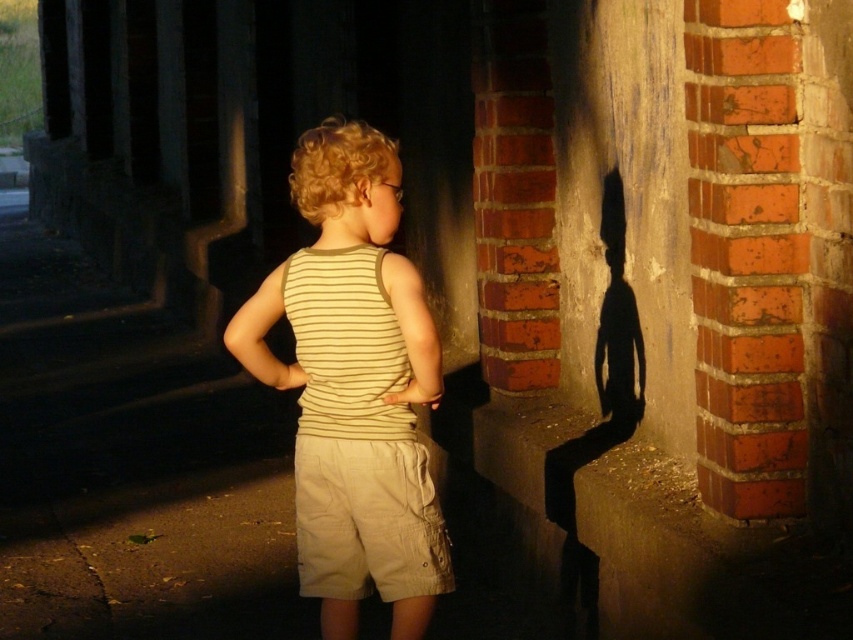
Question: Which object appears farthest from the camera in this image?

Choices:
 (A) striped cotton tank top at center
 (B) khaki cotton shorts at center

Answer: (B)

Question: Observing the image, what is the correct spatial positioning of striped cotton tank top at center in reference to khaki cotton shorts at center?

Choices:
 (A) below
 (B) above

Answer: (B)

Question: Does striped cotton tank top at center appear under khaki cotton shorts at center?

Choices:
 (A) no
 (B) yes

Answer: (A)

Question: Among these objects, which one is farthest from the camera?

Choices:
 (A) striped cotton tank top at center
 (B) khaki cotton shorts at center

Answer: (B)

Question: Is striped cotton tank top at center bigger than khaki cotton shorts at center?

Choices:
 (A) no
 (B) yes

Answer: (B)

Question: Among these points, which one is nearest to the camera?

Choices:
 (A) (281, 307)
 (B) (407, 490)

Answer: (B)